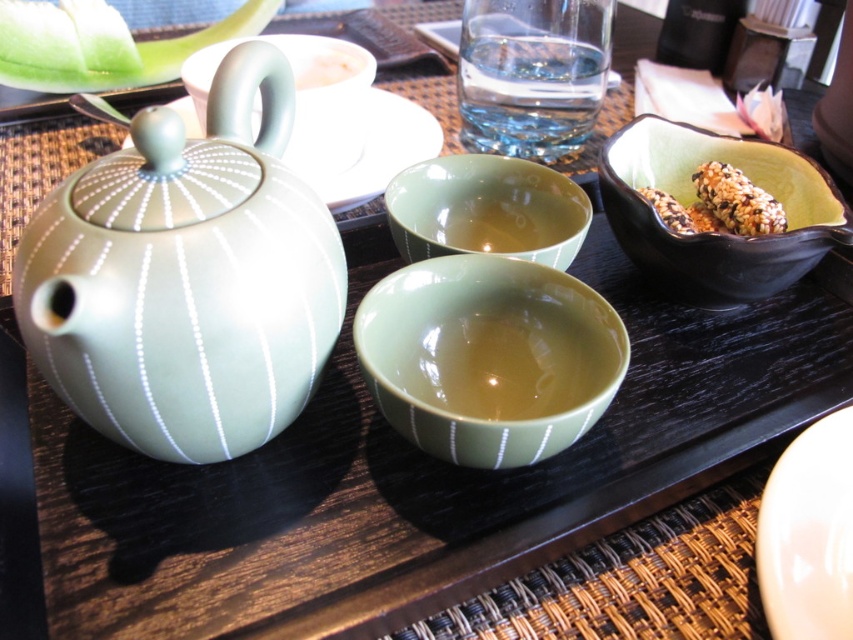
Where is `satin green teapot at left`? The width and height of the screenshot is (853, 640). satin green teapot at left is located at coordinates (187, 276).

Who is more distant from viewer, (337, 250) or (422, 180)?

Point (422, 180)

Locate an element on the screen. satin green teapot at left is located at coordinates (187, 276).

Between point (622, 170) and point (700, 198), which one is positioned in front?

Point (622, 170)

Which is below, black glossy bowl at upper right or sandy brown textured snack at right?

Positioned lower is black glossy bowl at upper right.

In order to click on black glossy bowl at upper right in this screenshot , I will do `click(717, 234)`.

Which of these two, white glossy plate at lower right or sandy brown rice ball at right, stands shorter?

sandy brown rice ball at right

Is point (788, 476) positioned in front of point (663, 198)?

Yes, it is.

Locate an element on the screen. white glossy plate at lower right is located at coordinates (808, 534).